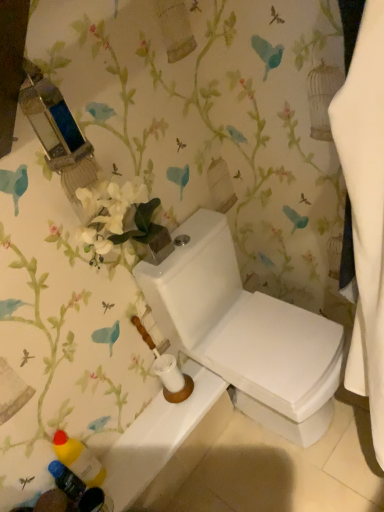
Question: In the image, is white glossy toilet at center positioned in front of or behind white glossy toilet at lower center?

Choices:
 (A) behind
 (B) front

Answer: (B)

Question: Based on their sizes in the image, would you say white glossy toilet at center is bigger or smaller than white glossy toilet at lower center?

Choices:
 (A) small
 (B) big

Answer: (B)

Question: Based on their relative distances, which object is nearer to the white glossy toilet at lower center?

Choices:
 (A) white glossy toilet at center
 (B) blue plastic bottle at lower left, marked as the 2th toiletry in a top-to-bottom arrangement
 (C) translucent plastic bottles at lower left, which ranks as the second toiletry in bottom-to-top order

Answer: (C)

Question: Which of these objects is positioned farthest from the translucent plastic bottles at lower left, which ranks as the second toiletry in bottom-to-top order?

Choices:
 (A) blue plastic bottle at lower left, marked as the 2th toiletry in a top-to-bottom arrangement
 (B) white glossy toilet at center
 (C) white glossy toilet at lower center

Answer: (B)